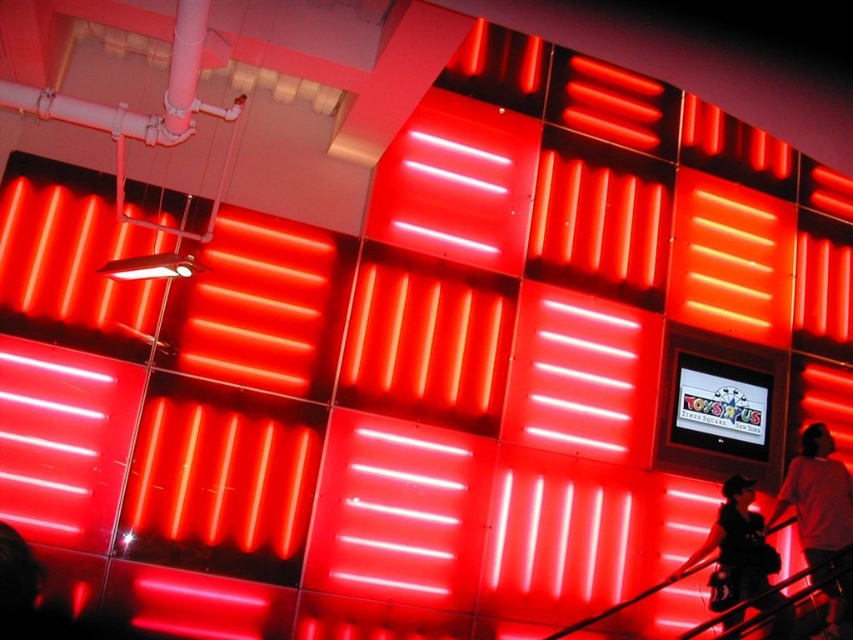
Question: Can you confirm if white cotton shirt at lower right is thinner than black leather boots at lower right?

Choices:
 (A) yes
 (B) no

Answer: (B)

Question: Considering the relative positions of white cotton shirt at lower right and black leather boots at lower right in the image provided, where is white cotton shirt at lower right located with respect to black leather boots at lower right?

Choices:
 (A) right
 (B) left

Answer: (A)

Question: Which object is closer to the camera taking this photo?

Choices:
 (A) white cotton shirt at lower right
 (B) black leather boots at lower right

Answer: (A)

Question: Can you confirm if white cotton shirt at lower right is positioned to the left of black leather boots at lower right?

Choices:
 (A) yes
 (B) no

Answer: (B)

Question: Which of the following is the closest to the observer?

Choices:
 (A) (763, 557)
 (B) (816, 522)

Answer: (A)